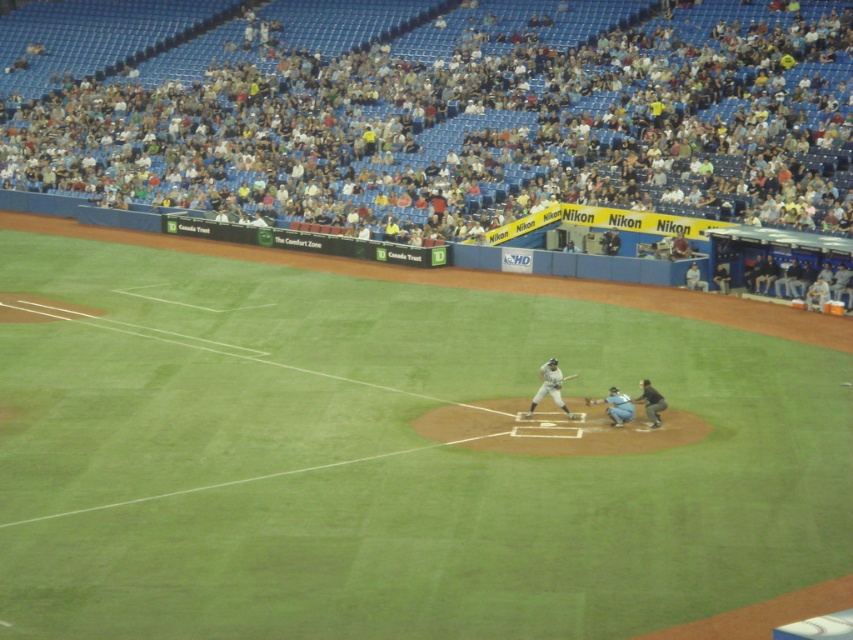
Does dark gray uniform at home plate lie behind brown leather glove at home plate?

No, dark gray uniform at home plate is closer to the viewer.

Who is positioned more to the right, dark gray uniform at home plate or brown leather glove at home plate?

From the viewer's perspective, dark gray uniform at home plate appears more on the right side.

Which is in front, point (647, 417) or point (593, 401)?

Point (647, 417) is more forward.

Locate an element on the screen. dark gray uniform at home plate is located at coordinates (651, 403).

Does blue fabric catcher at center have a greater height compared to brown leather glove at home plate?

Yes, blue fabric catcher at center is taller than brown leather glove at home plate.

Who is taller, blue fabric catcher at center or brown leather glove at home plate?

blue fabric catcher at center is taller.

Does point (622, 396) lie behind point (585, 397)?

No, (622, 396) is closer to viewer.

The image size is (853, 640). I want to click on blue fabric catcher at center, so click(x=618, y=406).

In the scene shown: Does green grass field at center have a greater width compared to gray uniformed man at center?

Yes.

Does green grass field at center have a greater height compared to gray uniformed man at center?

Yes, green grass field at center is taller than gray uniformed man at center.

Is point (314, 522) positioned in front of point (705, 285)?

Yes.

Identify the location of green grass field at center. The height and width of the screenshot is (640, 853). (397, 454).